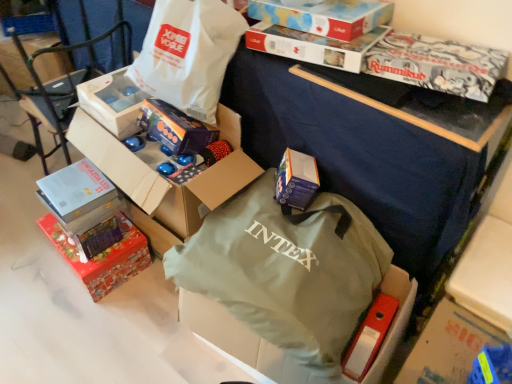
Question: In terms of width, does red glossy gift box at lower left, the first box when ordered from bottom to top, look wider or thinner when compared to white paper bag at upper center, the first bag viewed from the top?

Choices:
 (A) wide
 (B) thin

Answer: (B)

Question: In the image, is red glossy gift box at lower left, the first box when ordered from bottom to top, positioned in front of or behind white paper bag at upper center, marked as the second bag in a bottom-to-top arrangement?

Choices:
 (A) front
 (B) behind

Answer: (B)

Question: Based on their relative distances, which object is farther from the blue cardboard box at center, which ranks as the fourth box in top-to-bottom order?

Choices:
 (A) green fabric bag at center, the second bag from the top
 (B) matte purple gift box at center
 (C) white paper bag at upper center, marked as the second bag in a bottom-to-top arrangement
 (D) red glossy gift box at lower left, the first box when ordered from bottom to top
 (E) white matte box at upper left, the third box positioned from the top

Answer: (D)

Question: Which object is positioned farthest from the white matte box at upper left, acting as the third box starting from the bottom?

Choices:
 (A) matte purple gift box at center
 (B) matte cardboard box at left
 (C) matte cardboard box at upper center, arranged as the second box when viewed from the top
 (D) green fabric bag at center, acting as the first bag starting from the bottom
 (E) white paper bag at upper center, the first bag viewed from the top

Answer: (D)